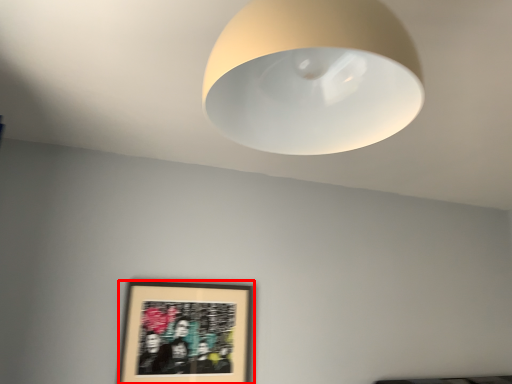
Question: From the image's perspective, where is picture frame (annotated by the red box) located relative to lamp?

Choices:
 (A) above
 (B) below

Answer: (B)